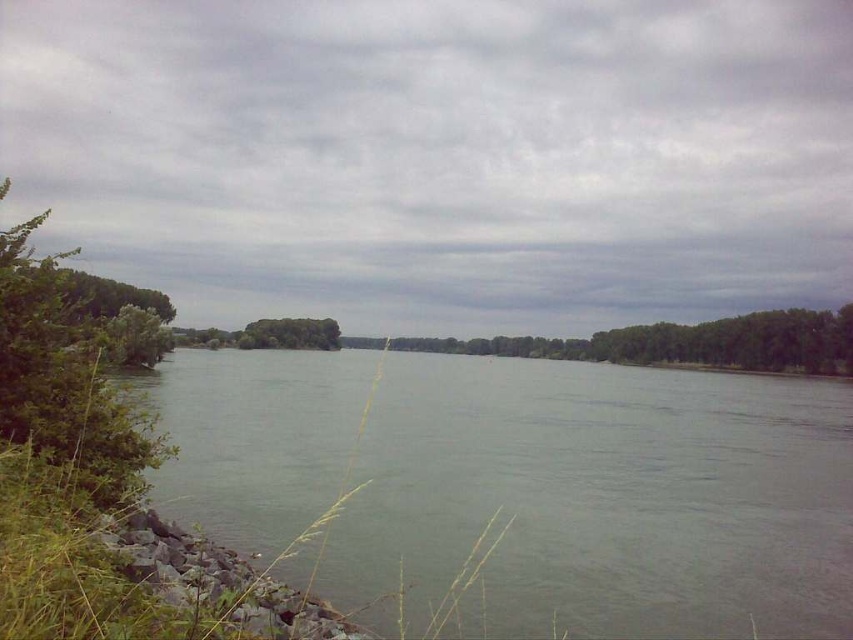
Question: Is gray water at center smaller than green leafy trees at center?

Choices:
 (A) no
 (B) yes

Answer: (B)

Question: Is gray water at center smaller than green leafy trees at center?

Choices:
 (A) no
 (B) yes

Answer: (B)

Question: Can you confirm if green leafy shrub at left is thinner than green leafy trees at center?

Choices:
 (A) no
 (B) yes

Answer: (B)

Question: Which point is closer to the camera taking this photo?

Choices:
 (A) (355, 552)
 (B) (662, 358)
 (C) (90, 420)

Answer: (C)

Question: Which object appears closest to the camera in this image?

Choices:
 (A) green leafy shrub at left
 (B) green leafy trees at center
 (C) gray water at center

Answer: (C)

Question: Which object is positioned farthest from the green leafy shrub at left?

Choices:
 (A) green leafy trees at center
 (B) gray water at center

Answer: (A)